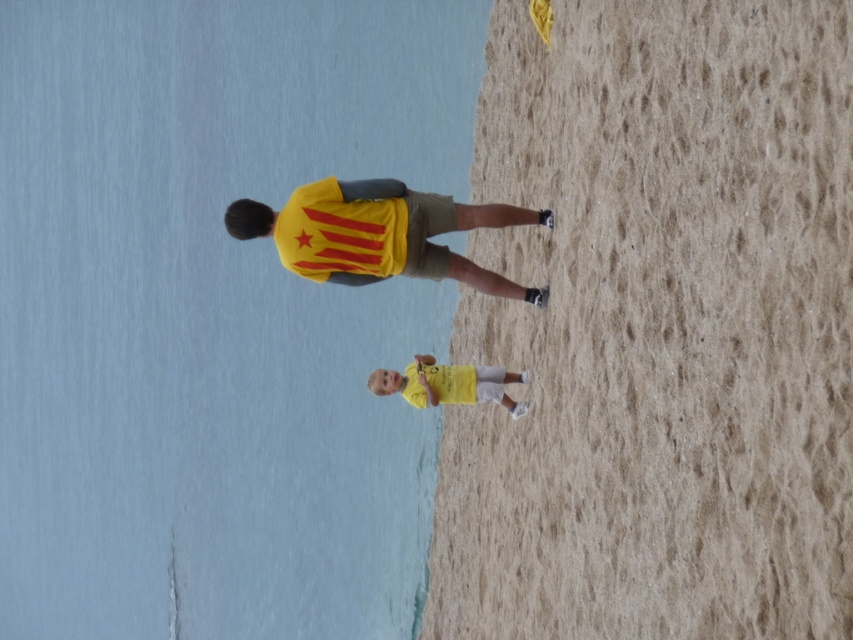
Does fine-grained sand at lower right appear on the left side of yellow matte shirt at center?

In fact, fine-grained sand at lower right is to the right of yellow matte shirt at center.

The width and height of the screenshot is (853, 640). What do you see at coordinates (659, 330) in the screenshot?
I see `fine-grained sand at lower right` at bounding box center [659, 330].

Between point (724, 529) and point (497, 401), which one is positioned in front?

Point (724, 529) is more forward.

Identify the location of fine-grained sand at lower right. (659, 330).

Is yellow fabric shirt at center bigger than yellow matte shirt at center?

Indeed, yellow fabric shirt at center has a larger size compared to yellow matte shirt at center.

Is yellow fabric shirt at center in front of yellow matte shirt at center?

Yes, it is in front of yellow matte shirt at center.

Is point (430, 204) more distant than point (374, 394)?

No, (430, 204) is closer to viewer.

The height and width of the screenshot is (640, 853). In order to click on yellow fabric shirt at center in this screenshot , I will do `click(379, 234)`.

Consider the image. Can you confirm if fine-grained sand at lower right is positioned above yellow fabric shirt at center?

Actually, fine-grained sand at lower right is below yellow fabric shirt at center.

Does point (691, 420) lie behind point (270, 208)?

No.

Find the location of `fine-grained sand at lower right`. fine-grained sand at lower right is located at coordinates (659, 330).